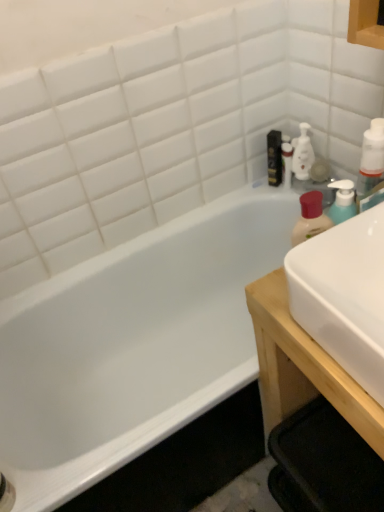
Locate an element on the screen. This screenshot has width=384, height=512. translucent plastic bottle at upper right is located at coordinates (286, 163).

In order to face translucent plastic bottle at upper right, should I rotate leftwards or rightwards?

Turn right approximately 12.928 degrees to face it.

Describe the element at coordinates (302, 153) in the screenshot. Image resolution: width=384 pixels, height=512 pixels. I see `white glossy bottle at upper right` at that location.

The height and width of the screenshot is (512, 384). What do you see at coordinates (133, 344) in the screenshot?
I see `white glossy bathtub at left` at bounding box center [133, 344].

The width and height of the screenshot is (384, 512). What do you see at coordinates (371, 160) in the screenshot?
I see `white plastic bottle at upper right` at bounding box center [371, 160].

The image size is (384, 512). I want to click on translucent plastic bottle at upper right, so click(x=286, y=163).

The height and width of the screenshot is (512, 384). Find the location of `sink below the white glossy bottle at upper right (from the image's perspective)`. sink below the white glossy bottle at upper right (from the image's perspective) is located at coordinates (344, 295).

Which of these two, white glossy bottle at upper right or white glossy sink at right, stands shorter?

white glossy sink at right is shorter.

Is white glossy bottle at upper right far away from white glossy sink at right?

Actually, white glossy bottle at upper right and white glossy sink at right are a little close together.

From the image's perspective, which is above, white glossy bottle at upper right or white glossy sink at right?

From the image's view, white glossy bottle at upper right is above.

What's the angular difference between white wood table at right and white glossy sink at right's facing directions?

The angular difference between white wood table at right and white glossy sink at right is 0.652 degrees.

Locate an element on the screen. The image size is (384, 512). table that is below the white glossy sink at right (from the image's perspective) is located at coordinates (302, 366).

From the picture: Can white glossy sink at right be found inside white wood table at right?

That's incorrect, white glossy sink at right is not inside white wood table at right.

From a real-world perspective, is white wood table at right on top of white glossy sink at right?

No, from a real-world perspective, white wood table at right is not above white glossy sink at right.

Considering the relative sizes of white glossy bathtub at left and black glossy bottle at upper right in the image provided, is white glossy bathtub at left bigger than black glossy bottle at upper right?

Indeed, white glossy bathtub at left has a larger size compared to black glossy bottle at upper right.

Between white glossy bathtub at left and black glossy bottle at upper right, which one has more height?

Standing taller between the two is white glossy bathtub at left.

From the picture: Is white glossy bathtub at left beside black glossy bottle at upper right?

white glossy bathtub at left and black glossy bottle at upper right are not in contact.

Which object is positioned more to the right, white glossy bathtub at left or black glossy bottle at upper right?

Positioned to the right is black glossy bottle at upper right.

Would you say black glossy bottle at upper right is part of white wood table at right's contents?

No.

Is white wood table at right turned away from black glossy bottle at upper right?

No, white wood table at right is not facing away from black glossy bottle at upper right.

From the image's perspective, which is below, white wood table at right or black glossy bottle at upper right?

white wood table at right, from the image's perspective.

Considering the relative sizes of white wood table at right and black glossy bottle at upper right in the image provided, is white wood table at right bigger than black glossy bottle at upper right?

Yes.

Considering the sizes of objects white wood table at right and white glossy bathtub at left in the image provided, who is taller, white wood table at right or white glossy bathtub at left?

With more height is white wood table at right.

Identify the location of bathtub above the white wood table at right (from the image's perspective). (133, 344).

Does point (260, 307) come behind point (107, 422)?

That is False.

Which object is wider, white wood table at right or white glossy bathtub at left?

white glossy bathtub at left is wider.

How far apart are white plastic bottle at upper right and white glossy bottle at upper right?

The distance of white plastic bottle at upper right from white glossy bottle at upper right is 28.79 inches.

Which of these two, white plastic bottle at upper right or white glossy bottle at upper right, is thinner?

Thinner between the two is white glossy bottle at upper right.

Is white glossy bottle at upper right surrounded by white plastic bottle at upper right?

No.

Is white glossy bottle at upper right at the back of white plastic bottle at upper right?

white plastic bottle at upper right is not turned away from white glossy bottle at upper right.

Considering the relative sizes of white glossy bottle at upper right and black glossy bottle at upper right in the image provided, is white glossy bottle at upper right wider than black glossy bottle at upper right?

No, white glossy bottle at upper right is not wider than black glossy bottle at upper right.

Is point (299, 144) behind point (270, 172)?

No, (299, 144) is in front of (270, 172).

From a real-world perspective, is white glossy bottle at upper right on black glossy bottle at upper right?

Actually, white glossy bottle at upper right is physically below black glossy bottle at upper right in the real world.

Is white glossy bottle at upper right situated inside black glossy bottle at upper right or outside?

white glossy bottle at upper right lies outside black glossy bottle at upper right.

Find the location of a particular element. Image resolution: width=384 pixels, height=512 pixels. cleaning product that is above the white glossy sink at right (from the image's perspective) is located at coordinates (302, 153).

Identify the location of table below the white glossy sink at right (from the image's perspective). The image size is (384, 512). (302, 366).

When comparing their distances from white wood table at right, does translucent plastic bottle at upper right or black glossy bottle at upper right seem closer?

Among the two, translucent plastic bottle at upper right is located nearer to white wood table at right.

When comparing their distances from white glossy bathtub at left, does white glossy bottle at upper right or white plastic bottle at upper right seem closer?

Result: white glossy bottle at upper right lies closer to white glossy bathtub at left than the other object.

Considering their positions, is black glossy bottle at upper right positioned closer to white glossy bathtub at left than translucent plastic bottle at upper right?

black glossy bottle at upper right lies closer to white glossy bathtub at left than the other object.

Based on their spatial positions, is black glossy bottle at upper right or white plastic bottle at upper right closer to white glossy bottle at upper right?

The object closer to white glossy bottle at upper right is black glossy bottle at upper right.

Looking at the image, which one is located further to white plastic bottle at upper right, white wood table at right or black glossy bottle at upper right?

The object further to white plastic bottle at upper right is black glossy bottle at upper right.

Which object lies nearer to the anchor point white plastic bottle at upper right, white glossy sink at right or black glossy bottle at upper right?

white glossy sink at right is positioned closer to the anchor white plastic bottle at upper right.

From the image, which object appears to be nearer to white wood table at right, white plastic bottle at upper right or white glossy bathtub at left?

The object closer to white wood table at right is white plastic bottle at upper right.

Consider the image. Considering their positions, is translucent plastic bottle at upper right positioned closer to white glossy bottle at upper right than white glossy bathtub at left?

Based on the image, translucent plastic bottle at upper right appears to be nearer to white glossy bottle at upper right.

Where is `cleaning product between white plastic bottle at upper right and black glossy bottle at upper right along the z-axis`? Image resolution: width=384 pixels, height=512 pixels. cleaning product between white plastic bottle at upper right and black glossy bottle at upper right along the z-axis is located at coordinates (302, 153).

Find the location of a particular element. Image resolution: width=384 pixels, height=512 pixels. bathtub between white wood table at right and white glossy bottle at upper right in the front-back direction is located at coordinates (133, 344).

The image size is (384, 512). Identify the location of table located between white glossy sink at right and translucent plastic bottle at upper right in the depth direction. (302, 366).

What are the coordinates of `toiletry between white glossy bathtub at left and black glossy bottle at upper right from front to back` in the screenshot? It's located at (286, 163).